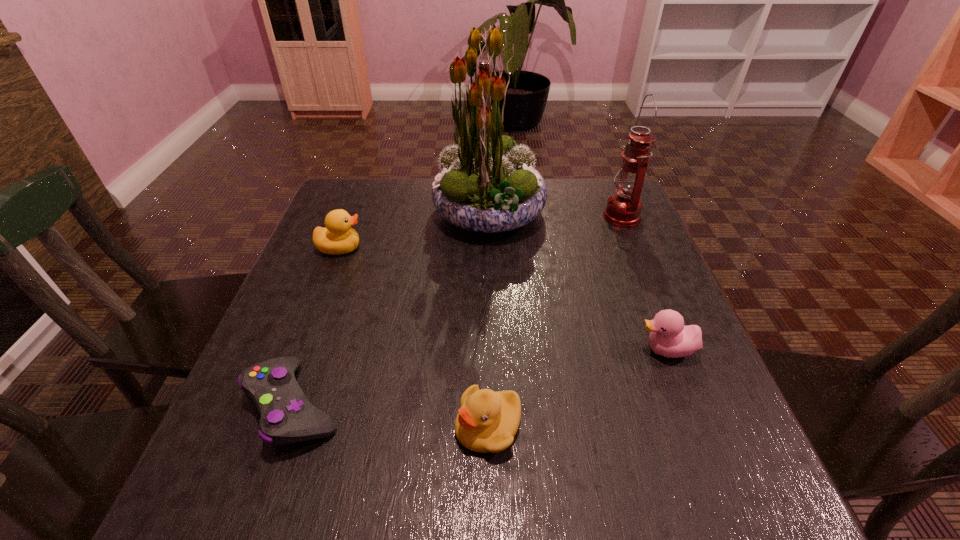
The width and height of the screenshot is (960, 540). In order to click on object positioned at the near edge in this screenshot , I will do `click(487, 421)`.

The width and height of the screenshot is (960, 540). I want to click on duckling situated at the left edge, so click(338, 237).

I want to click on control that is at the left edge, so click(287, 416).

Identify the location of oil lamp that is positioned at the right edge. (623, 209).

Where is `duckling at the right edge`? The width and height of the screenshot is (960, 540). duckling at the right edge is located at coordinates (669, 337).

Locate an element on the screen. This screenshot has height=540, width=960. object at the far right corner is located at coordinates (x=623, y=209).

Find the location of a particular element. Image resolution: width=960 pixels, height=540 pixels. free space at the far edge of the desktop is located at coordinates (409, 194).

In the image, there is a desktop. Where is `vacant area at the near edge`? Image resolution: width=960 pixels, height=540 pixels. vacant area at the near edge is located at coordinates (325, 507).

This screenshot has height=540, width=960. I want to click on vacant space at the left edge, so click(x=329, y=263).

Find the location of `vacant region at the right edge`. vacant region at the right edge is located at coordinates (598, 246).